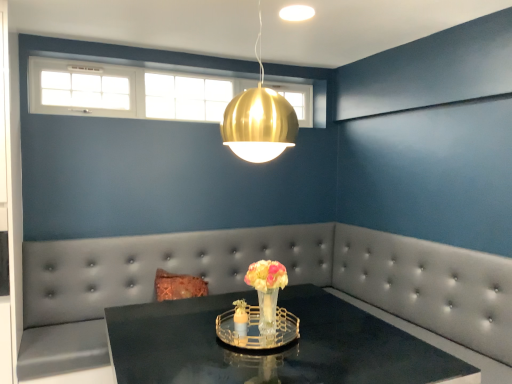
Where is `space that is in front of translucent glass vase at center`? space that is in front of translucent glass vase at center is located at coordinates (284, 359).